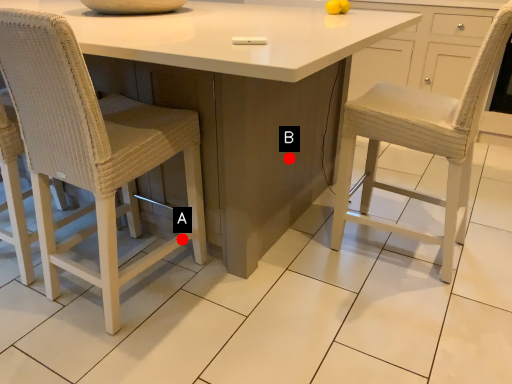
Question: Two points are circled on the image, labeled by A and B beside each circle. Which point is closer to the camera taking this photo?

Choices:
 (A) A is closer
 (B) B is closer

Answer: (A)